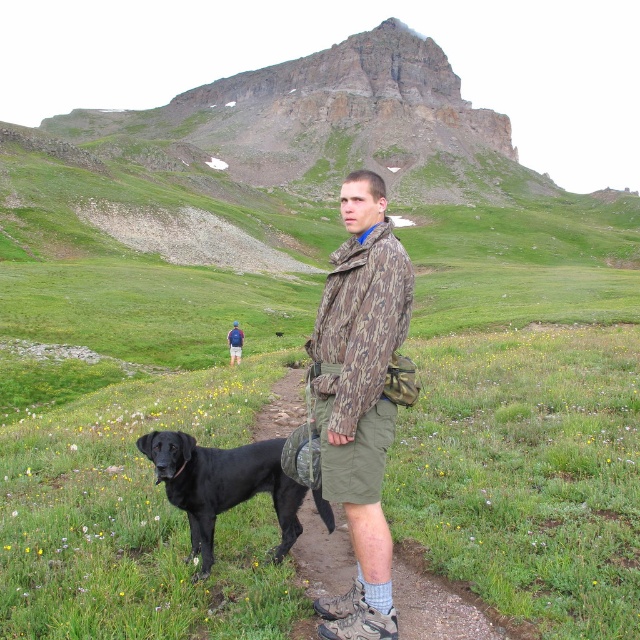
You are a hiker who wants to place a marker at the point that is closer to you. Which point should you choose between point (365, 346) and point (177, 445)?

Point (365, 346) is in front of point (177, 445), so you should choose point (365, 346) as it is closer to you.

You are a photographer trying to capture a photo of both the camo jacket at center and the black matte dog at lower left in the same frame. Based on their heights, which one should you focus on first to ensure both are in focus?

The camo jacket at center is taller than the black matte dog at lower left, so you should focus on the camo jacket at center first to ensure both are in focus.